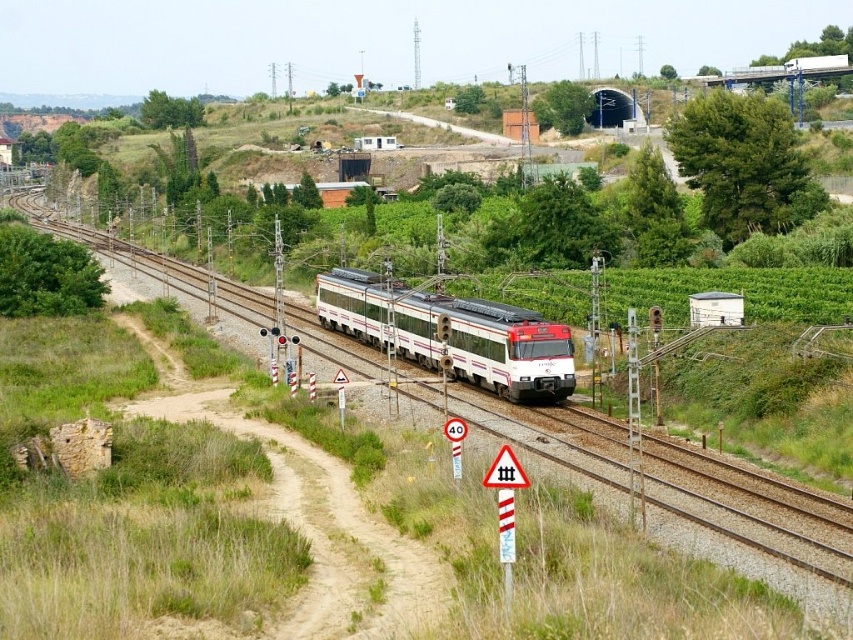
Who is positioned more to the right, white glossy train at center or white glossy passenger train at center?

white glossy passenger train at center

Which is behind, point (241, 312) or point (383, 314)?

Point (241, 312)

The width and height of the screenshot is (853, 640). Find the location of `white glossy train at center`. white glossy train at center is located at coordinates (749, 529).